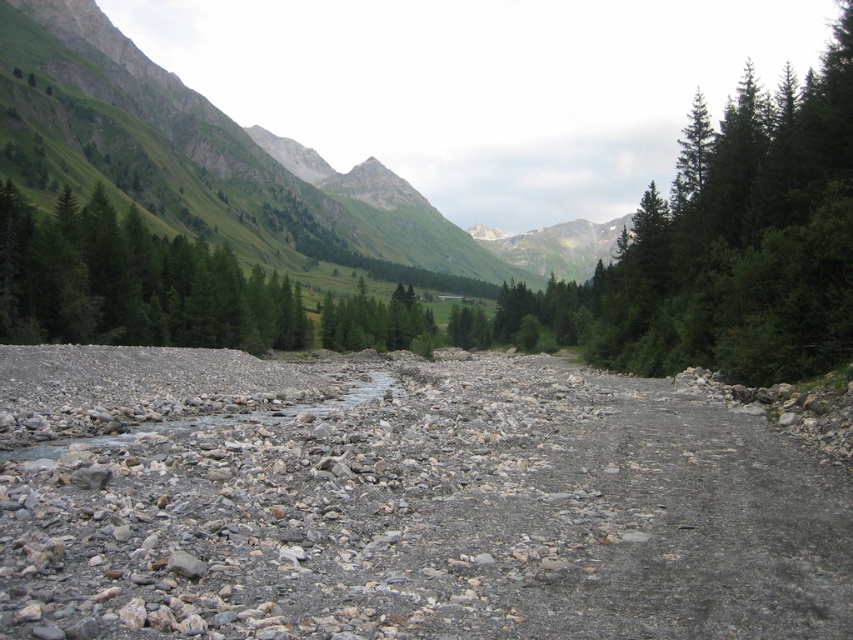
You are a hiker trying to navigate through the mountain valley. You see a green matte tree at left and a green matte tree at center. Which tree would provide more shade if you sit under it?

The green matte tree at left is bigger than the green matte tree at center, so it would provide more shade.

You are standing at the base of the mountains in the scene and want to walk towards the point marked as point (361, 305). However, there is a point marked as point (80, 509) blocking your path. Will you need to go around it or can you walk straight through?

Point (80, 509) is in front of point (361, 305), so you will need to go around it to reach your destination.

You are a hiker trying to cross the gray gravel bed at center and the green matte tree at left. Which object is located to the right of the other?

The gray gravel bed at center is positioned on the right side of green matte tree at left, so the gravel bed is to the right of the tree.